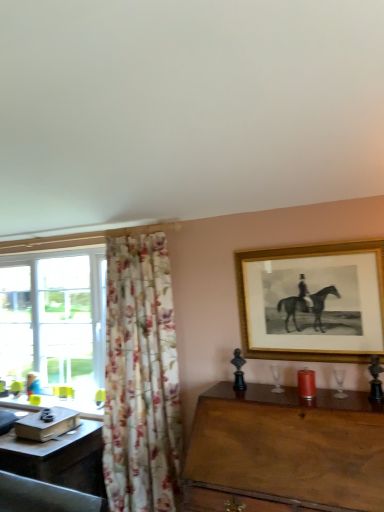
Question: From a real-world perspective, is gold framed print at upper right physically located above or below wooden table at right?

Choices:
 (A) above
 (B) below

Answer: (A)

Question: Considering the positions of gold framed print at upper right and wooden table at right in the image, is gold framed print at upper right taller or shorter than wooden table at right?

Choices:
 (A) tall
 (B) short

Answer: (B)

Question: Which object is the farthest from the gold framed print at upper right?

Choices:
 (A) wooden desk at lower left
 (B) floral fabric curtain at left
 (C) wooden table at right
 (D) matte black book at left
 (E) blue fabric person at lower left

Answer: (E)

Question: Which object is positioned closest to the wooden desk at lower left?

Choices:
 (A) floral fabric curtain at left
 (B) wooden table at right
 (C) matte black book at left
 (D) gold framed print at upper right
 (E) blue fabric person at lower left

Answer: (C)